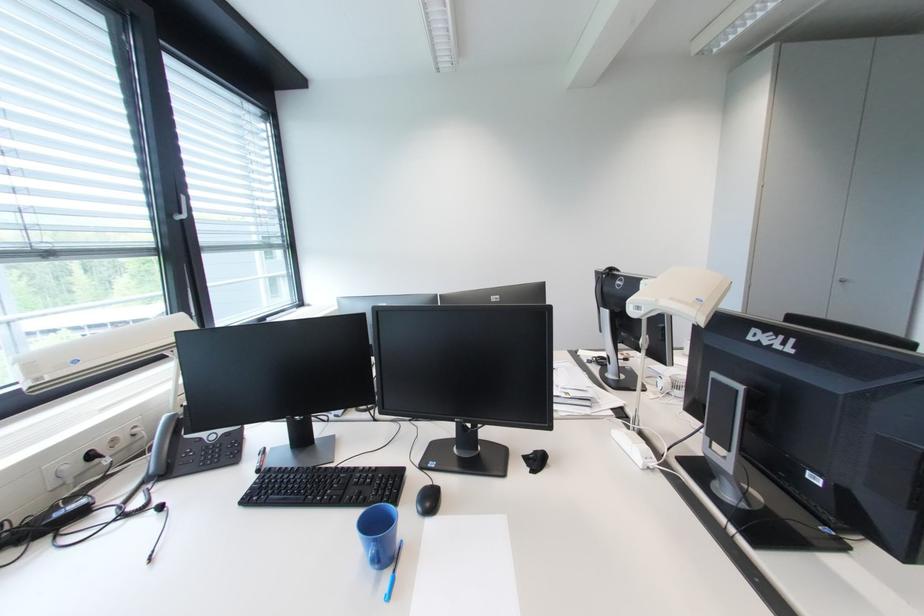
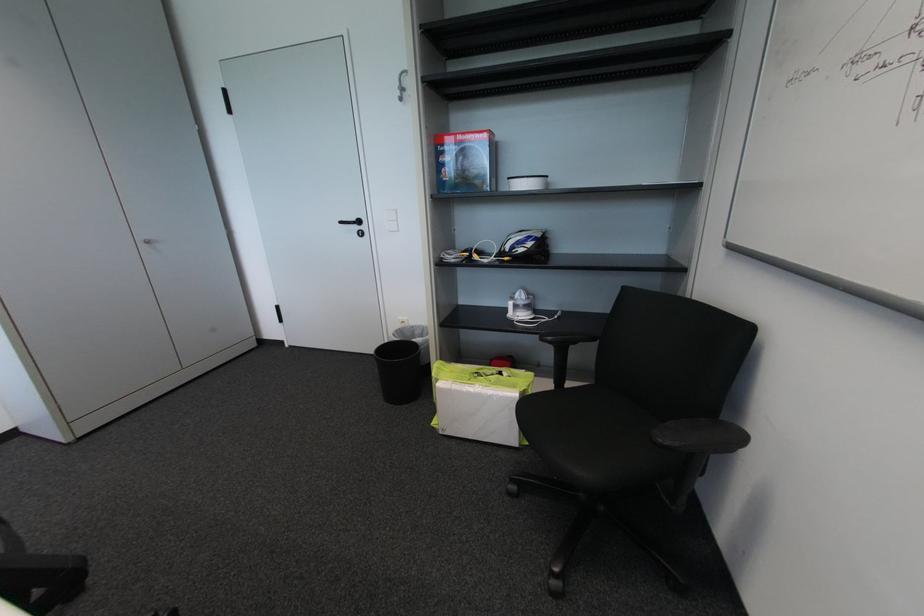
Locate, in the second image, the point that corresponds to point (844, 285) in the first image.

(151, 246)